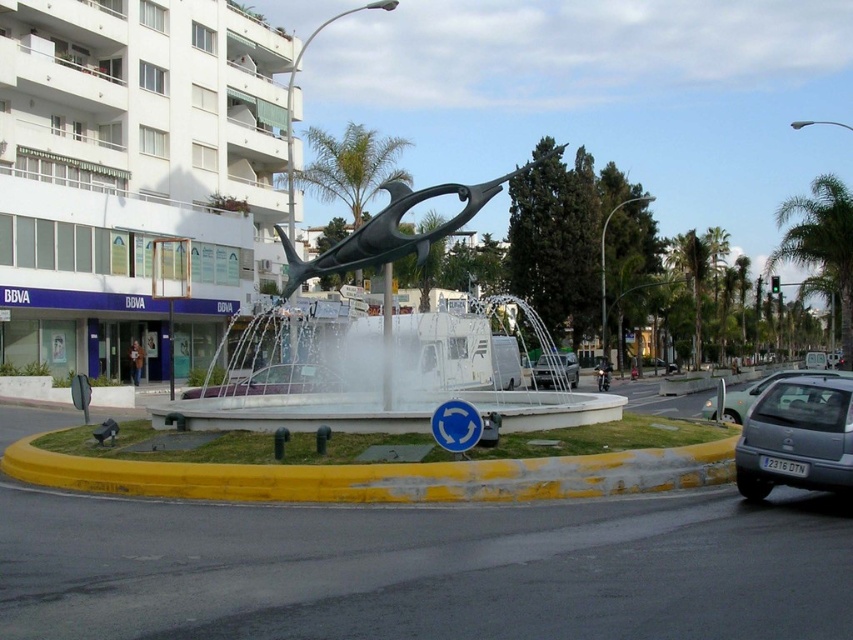
Question: Where is white marble fountain at center located in relation to metallic gray hatchback at lower right in the image?

Choices:
 (A) below
 (B) above

Answer: (B)

Question: Which point is closer to the camera taking this photo?

Choices:
 (A) (775, 378)
 (B) (785, 420)
 (C) (364, 413)

Answer: (B)

Question: Which object is the farthest from the silver metallic sedan at right?

Choices:
 (A) yellow concrete curb at lower center
 (B) white glossy building at upper left
 (C) silver metallic sedan at center
 (D) white marble fountain at center

Answer: (B)

Question: Can you confirm if metallic gray hatchback at lower right is positioned to the right of silver metallic sedan at center?

Choices:
 (A) yes
 (B) no

Answer: (B)

Question: Which object is the closest to the metallic gray hatchback at lower right?

Choices:
 (A) silver metallic sedan at center
 (B) yellow concrete curb at lower center

Answer: (B)

Question: Does white marble fountain at center appear under silver metallic sedan at center?

Choices:
 (A) yes
 (B) no

Answer: (B)